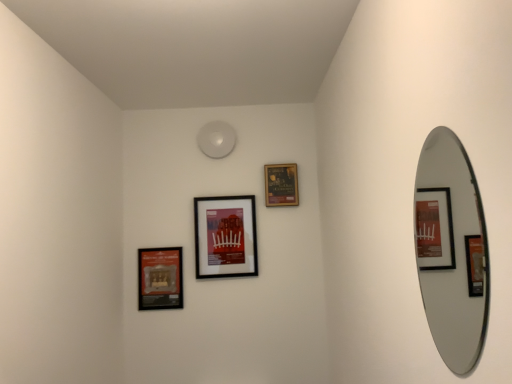
Question: From a real-world perspective, is matte black picture frame at center, the 2th picture frame when ordered from right to left, on silver metallic mirror at right?

Choices:
 (A) yes
 (B) no

Answer: (A)

Question: Considering the relative sizes of matte black picture frame at center, the second picture frame positioned from the left, and silver metallic mirror at right in the image provided, is matte black picture frame at center, the second picture frame positioned from the left, smaller than silver metallic mirror at right?

Choices:
 (A) no
 (B) yes

Answer: (A)

Question: Would you say matte black picture frame at center, the 2th picture frame when ordered from right to left, contains silver metallic mirror at right?

Choices:
 (A) yes
 (B) no

Answer: (B)

Question: From the image's perspective, is matte black picture frame at center, the 2th picture frame when ordered from right to left, under silver metallic mirror at right?

Choices:
 (A) no
 (B) yes

Answer: (B)

Question: Is matte black picture frame at center, the 2th picture frame when ordered from right to left, oriented away from silver metallic mirror at right?

Choices:
 (A) no
 (B) yes

Answer: (A)

Question: Does matte black picture frame at center, the 2th picture frame when ordered from right to left, have a greater height compared to silver metallic mirror at right?

Choices:
 (A) no
 (B) yes

Answer: (A)

Question: From the image's perspective, would you say matte black picture frame at upper center, arranged as the 1th picture frame when viewed from the right, is shown under matte black picture frame at center, the 2th picture frame when ordered from right to left?

Choices:
 (A) no
 (B) yes

Answer: (A)

Question: Does matte black picture frame at upper center, arranged as the 1th picture frame when viewed from the right, have a greater width compared to matte black picture frame at center, the 2th picture frame when ordered from right to left?

Choices:
 (A) no
 (B) yes

Answer: (A)

Question: Does matte black picture frame at upper center, arranged as the 1th picture frame when viewed from the right, appear on the left side of matte black picture frame at center, the 2th picture frame when ordered from right to left?

Choices:
 (A) yes
 (B) no

Answer: (B)

Question: Can you confirm if matte black picture frame at upper center, arranged as the 1th picture frame when viewed from the right, is shorter than matte black picture frame at center, the 2th picture frame when ordered from right to left?

Choices:
 (A) no
 (B) yes

Answer: (B)

Question: From the image's perspective, does matte black picture frame at upper center, arranged as the 3th picture frame when viewed from the left, appear higher than matte black picture frame at center, the second picture frame positioned from the left?

Choices:
 (A) no
 (B) yes

Answer: (B)

Question: From a real-world perspective, does matte black picture frame at upper center, arranged as the 3th picture frame when viewed from the left, sit lower than matte black picture frame at center, the 2th picture frame when ordered from right to left?

Choices:
 (A) no
 (B) yes

Answer: (A)

Question: Does silver metallic mirror at right have a lesser height compared to matte black picture frame at lower left, which appears as the first picture frame when viewed from the left?

Choices:
 (A) no
 (B) yes

Answer: (A)